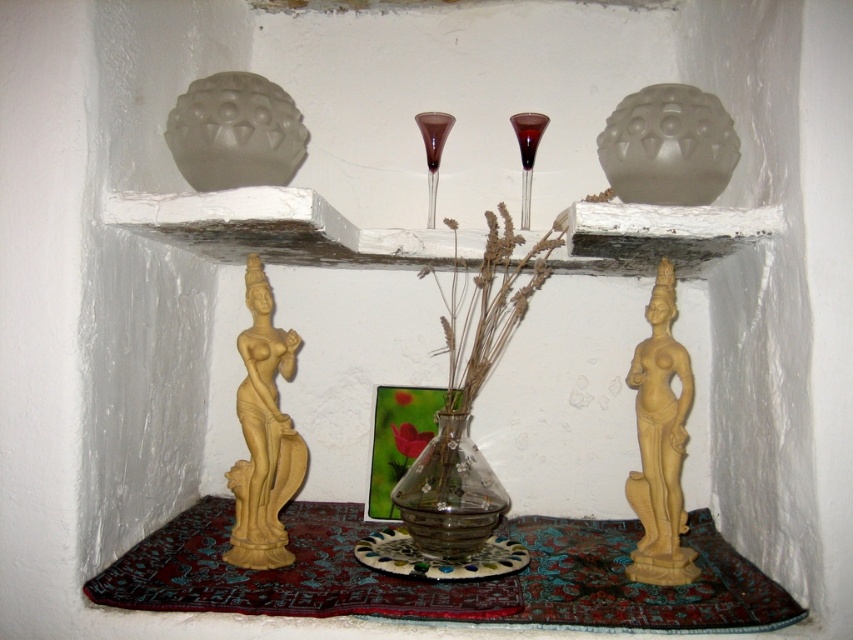
Is point (244, 340) farther from viewer compared to point (692, 579)?

Yes.

I want to click on matte yellow statue at lower left, so click(263, 435).

Where is `matte yellow statue at lower left`? This screenshot has width=853, height=640. matte yellow statue at lower left is located at coordinates (263, 435).

Is point (271, 541) behind point (485, 532)?

No, it is in front of (485, 532).

Locate an element on the screen. matte yellow statue at lower left is located at coordinates (263, 435).

The width and height of the screenshot is (853, 640). I want to click on matte yellow statue at lower left, so tap(263, 435).

Does matte yellow statue at lower right appear on the right side of transparent glass vase at center?

Correct, you'll find matte yellow statue at lower right to the right of transparent glass vase at center.

Does point (645, 420) lie in front of point (445, 497)?

Yes, point (645, 420) is closer to viewer.

Locate an element on the screen. matte yellow statue at lower right is located at coordinates [x=660, y=444].